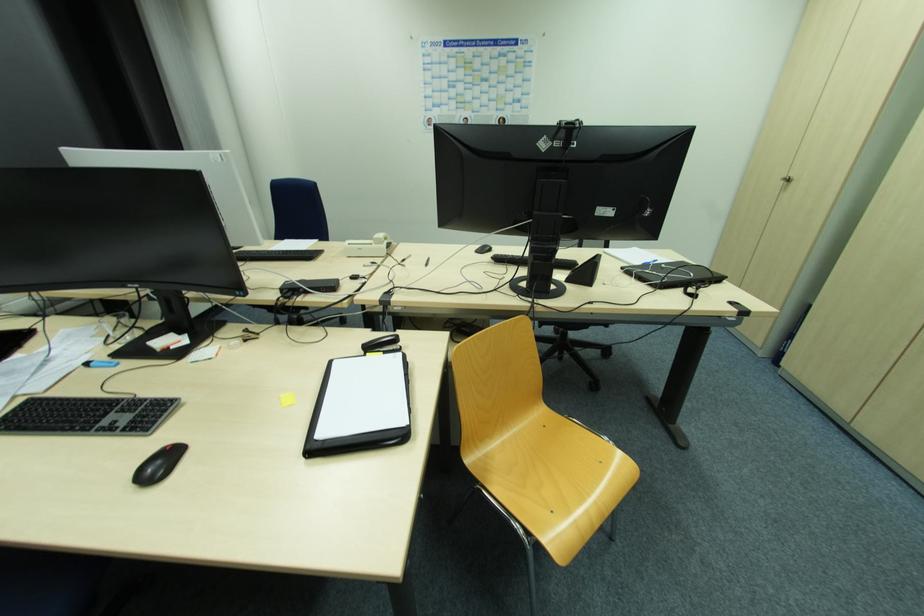
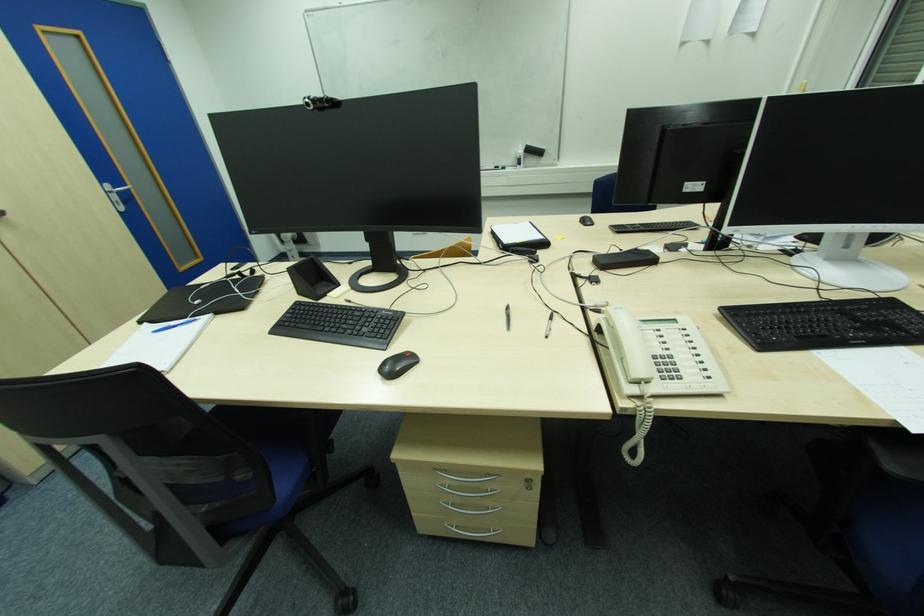
Locate, in the second image, the point that corresponds to point (429, 265) in the first image.

(509, 309)